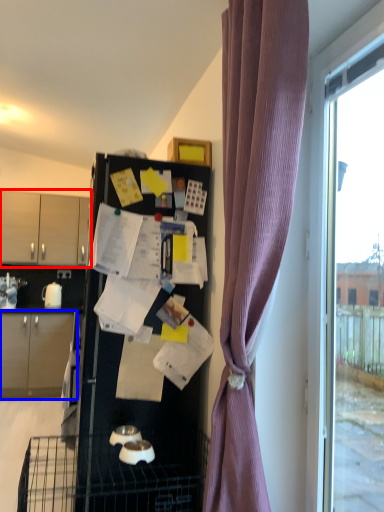
Question: Which object appears closest to the camera in this image, cabinetry (highlighted by a red box) or cabinetry (highlighted by a blue box)?

Choices:
 (A) cabinetry
 (B) cabinetry

Answer: (B)